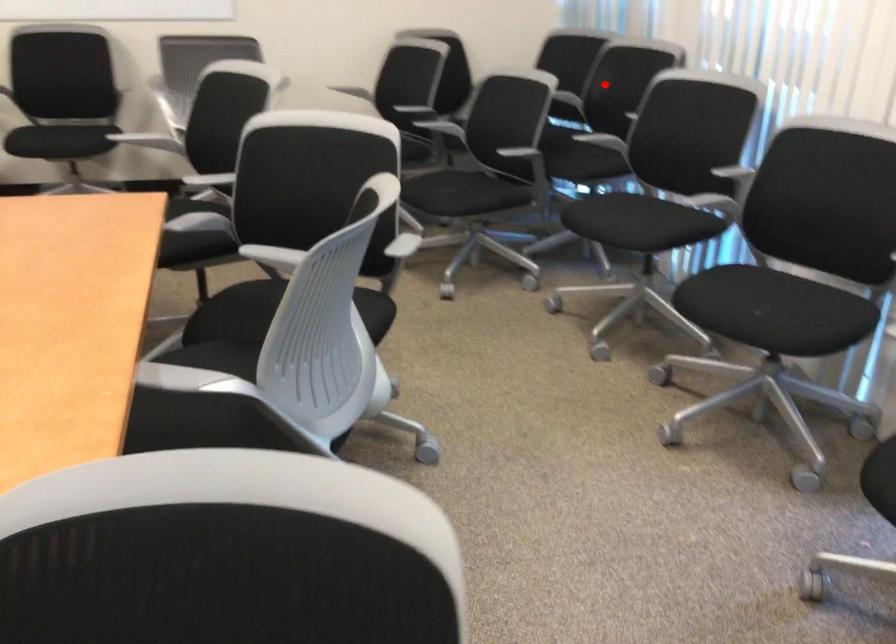
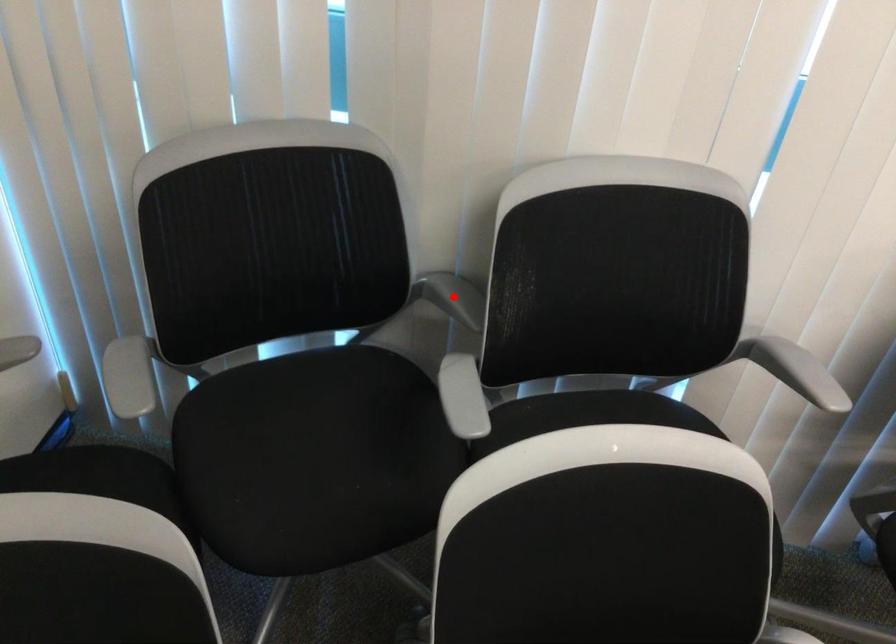
I am providing you with two images of the same scene from different viewpoints. A red point is marked on the first image and another point is marked on the second image. Does the point marked in image1 correspond to the same location as the one in image2?

Yes